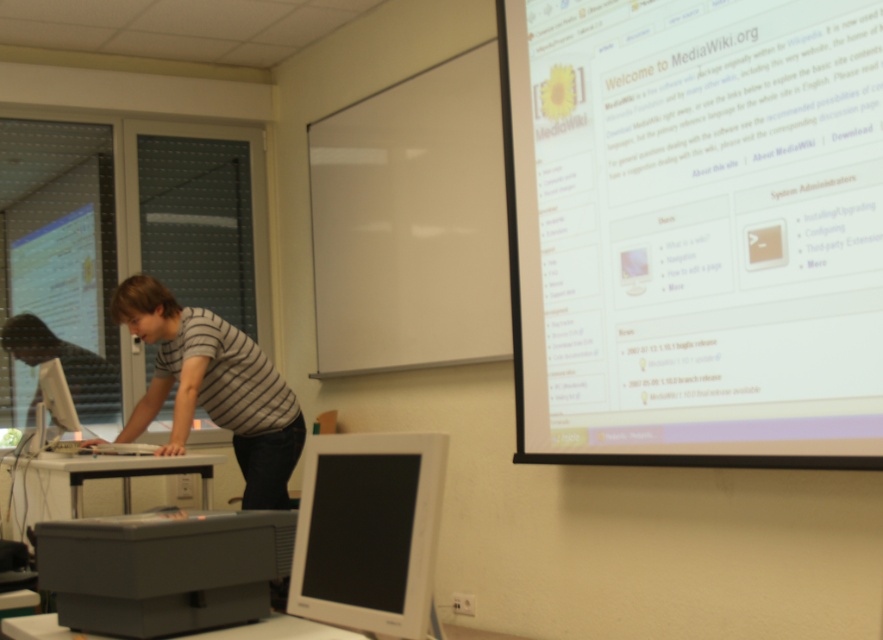
Does matte gray printer at lower left appear over white plastic monitor at center?

Incorrect, matte gray printer at lower left is not positioned above white plastic monitor at center.

In the scene shown: Is matte gray printer at lower left to the right of white plastic monitor at center from the viewer's perspective?

In fact, matte gray printer at lower left is to the left of white plastic monitor at center.

Is point (216, 618) positioned behind point (374, 509)?

Yes, it is.

Find the location of a particular element. The width and height of the screenshot is (883, 640). matte gray printer at lower left is located at coordinates (163, 570).

Does white glossy projector screen at upper right have a larger size compared to white plastic monitor at center?

Yes, white glossy projector screen at upper right is bigger than white plastic monitor at center.

Between point (706, 385) and point (336, 570), which one is positioned behind?

Positioned behind is point (706, 385).

Where is `white glossy projector screen at upper right`? The height and width of the screenshot is (640, 883). white glossy projector screen at upper right is located at coordinates (695, 228).

Can you confirm if white glossy projector screen at upper right is positioned to the left of striped fabric shirt at center?

In fact, white glossy projector screen at upper right is to the right of striped fabric shirt at center.

Is white glossy projector screen at upper right taller than striped fabric shirt at center?

Yes.

Which is in front, point (782, 461) or point (138, 301)?

Point (782, 461) is in front.

Locate an element on the screen. Image resolution: width=883 pixels, height=640 pixels. white glossy projector screen at upper right is located at coordinates (695, 228).